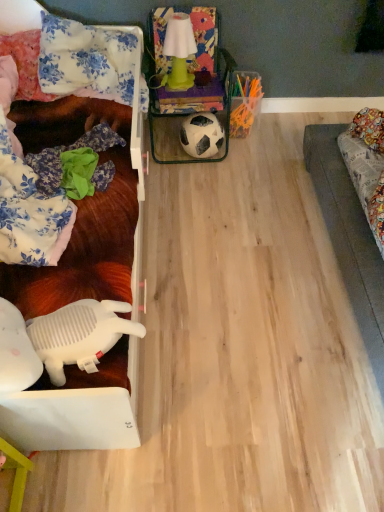
Identify the location of free space in front of white matte football at center. (207, 180).